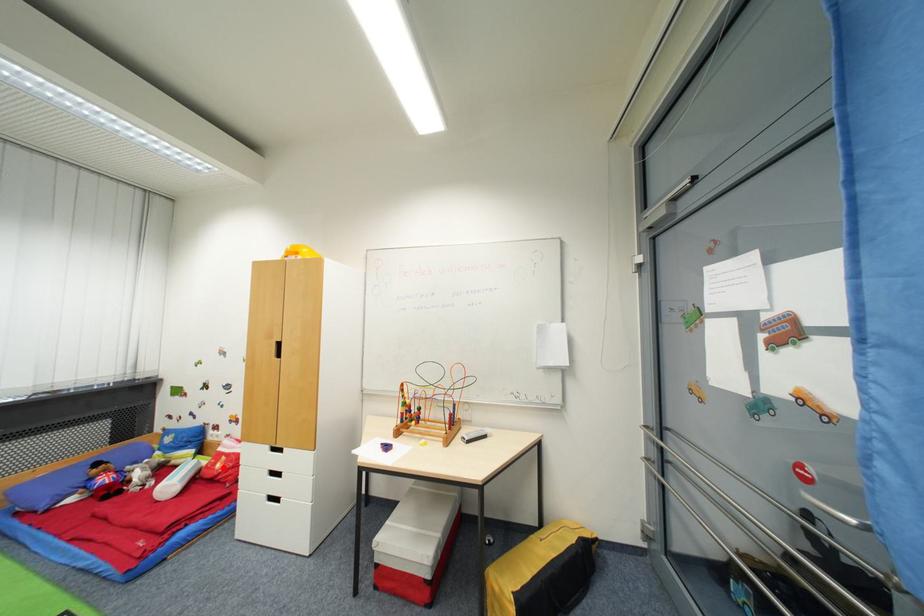
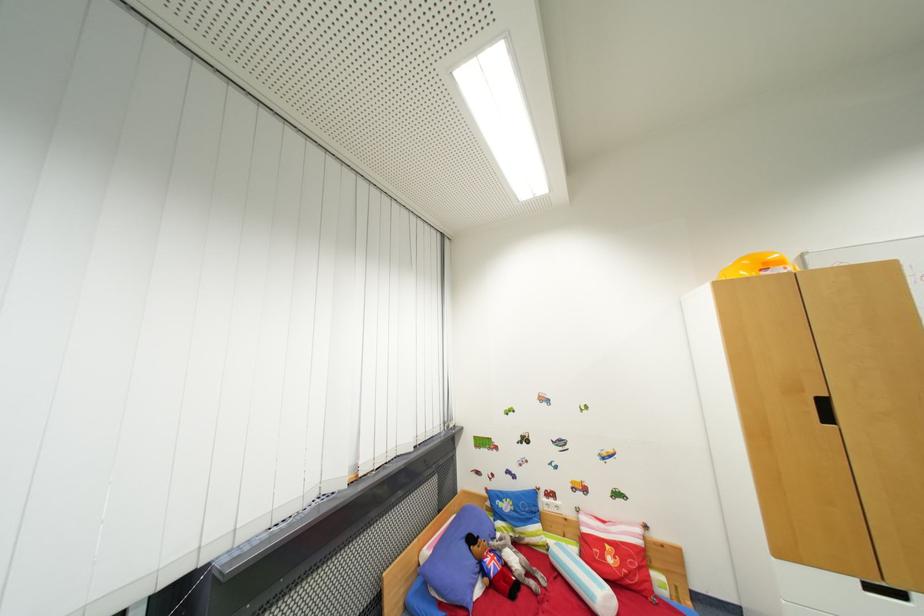
Locate, in the second image, the point that corresponds to the highlighted location in the first image.

(614, 562)